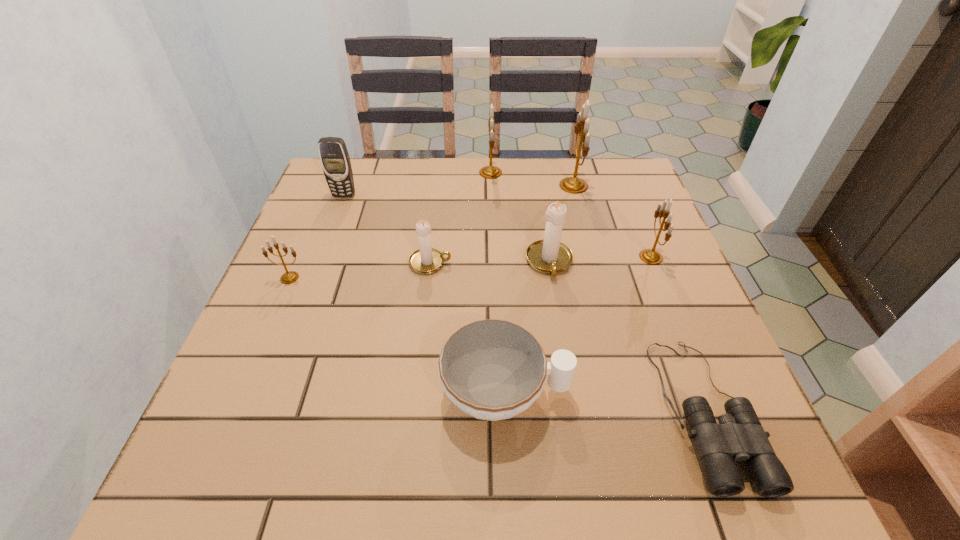
Image resolution: width=960 pixels, height=540 pixels. I want to click on free space located on the back of the rightmost candle holder, so click(x=617, y=175).

I want to click on vacant space located 0.170m on the back of the smallest gold candelabrum, so click(x=312, y=225).

This screenshot has width=960, height=540. Identify the location of vacant space situated 0.090m on the handle side of the second candle holder from left to right. (490, 263).

Locate an element on the screen. vacant space located 0.250m on the side with the handle of the second shortest object is located at coordinates (708, 392).

Image resolution: width=960 pixels, height=540 pixels. In order to click on cellular telephone present at the far edge in this screenshot , I will do `click(334, 157)`.

At what (x,y) coordinates should I click in order to perform the action: click on object situated at the near edge. Please return your answer as a coordinate pair (x, y). The image size is (960, 540). Looking at the image, I should click on (739, 435).

Where is `cellular telephone at the left edge`? The height and width of the screenshot is (540, 960). cellular telephone at the left edge is located at coordinates (334, 157).

Find the location of `candelabrum present at the left edge`. candelabrum present at the left edge is located at coordinates (289, 277).

I want to click on binoculars located in the right edge section of the desktop, so click(x=739, y=435).

Find the location of `object positioned at the far left corner`. object positioned at the far left corner is located at coordinates (334, 157).